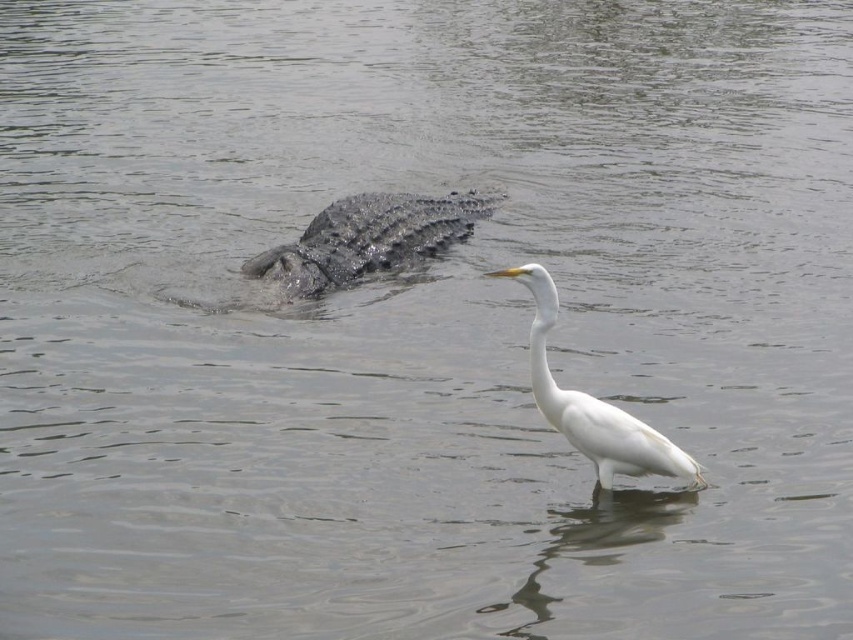
Question: Which point is closer to the camera?

Choices:
 (A) (305, 260)
 (B) (544, 378)

Answer: (B)

Question: Does dark gray scaly crocodile at center appear over white smooth bird at center?

Choices:
 (A) no
 (B) yes

Answer: (B)

Question: Which point is farther from the camera taking this photo?

Choices:
 (A) (553, 406)
 (B) (415, 252)

Answer: (B)

Question: Is dark gray scaly crocodile at center wider than white smooth bird at center?

Choices:
 (A) yes
 (B) no

Answer: (A)

Question: Where is dark gray scaly crocodile at center located in relation to white smooth bird at center in the image?

Choices:
 (A) right
 (B) left

Answer: (B)